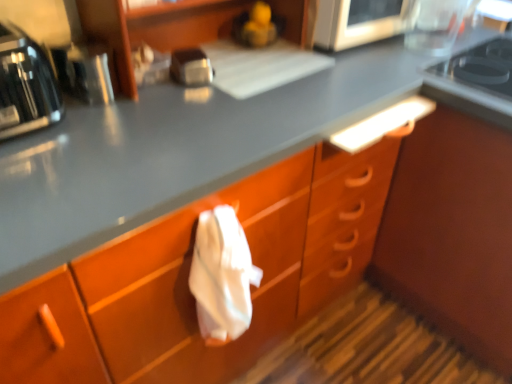
This screenshot has width=512, height=384. Find the location of `vacant point to the right of satin silver toaster at upper center`. vacant point to the right of satin silver toaster at upper center is located at coordinates (257, 81).